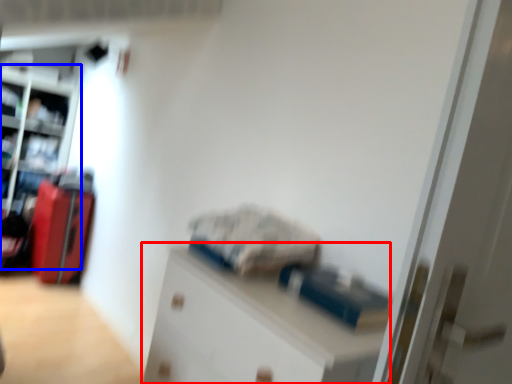
Question: Which object is closer to the camera taking this photo, cabinetry (highlighted by a red box) or bookshelf (highlighted by a blue box)?

Choices:
 (A) cabinetry
 (B) bookshelf

Answer: (A)